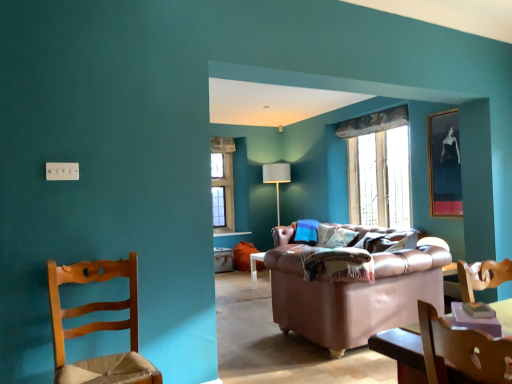
Question: Is clear glass window at center to the right of white plastic electric outlet at upper left from the viewer's perspective?

Choices:
 (A) no
 (B) yes

Answer: (B)

Question: Can you confirm if clear glass window at center is thinner than white plastic electric outlet at upper left?

Choices:
 (A) yes
 (B) no

Answer: (B)

Question: Is clear glass window at center outside white plastic electric outlet at upper left?

Choices:
 (A) no
 (B) yes

Answer: (B)

Question: Can you confirm if clear glass window at center is shorter than white plastic electric outlet at upper left?

Choices:
 (A) yes
 (B) no

Answer: (B)

Question: Is clear glass window at center to the left of white plastic electric outlet at upper left from the viewer's perspective?

Choices:
 (A) yes
 (B) no

Answer: (B)

Question: Does clear glass window at center have a larger size compared to white plastic electric outlet at upper left?

Choices:
 (A) no
 (B) yes

Answer: (B)

Question: Is clear glass window at center positioned with its back to wooden chair at left?

Choices:
 (A) no
 (B) yes

Answer: (A)

Question: Is clear glass window at center oriented towards wooden chair at left?

Choices:
 (A) no
 (B) yes

Answer: (A)

Question: Can you confirm if clear glass window at center is thinner than wooden chair at left?

Choices:
 (A) yes
 (B) no

Answer: (A)

Question: From a real-world perspective, does clear glass window at center sit lower than wooden chair at left?

Choices:
 (A) no
 (B) yes

Answer: (A)

Question: From the image's perspective, is clear glass window at center on top of wooden chair at left?

Choices:
 (A) yes
 (B) no

Answer: (A)

Question: Can you confirm if clear glass window at center is taller than wooden chair at left?

Choices:
 (A) no
 (B) yes

Answer: (B)

Question: From the image's perspective, is leather couch at center on wooden chair at left?

Choices:
 (A) yes
 (B) no

Answer: (B)